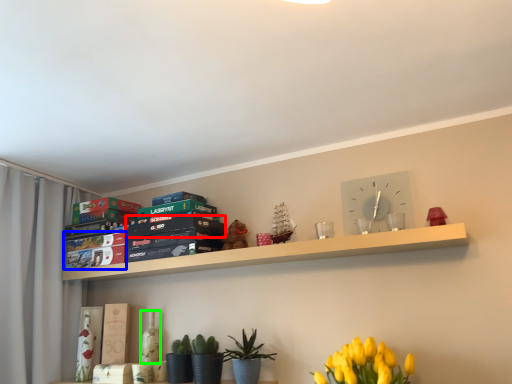
Question: Which is farther away from paperback book (highlighted by a red box)? paperback book (highlighted by a blue box) or bottle (highlighted by a green box)?

Choices:
 (A) paperback book
 (B) bottle

Answer: (B)